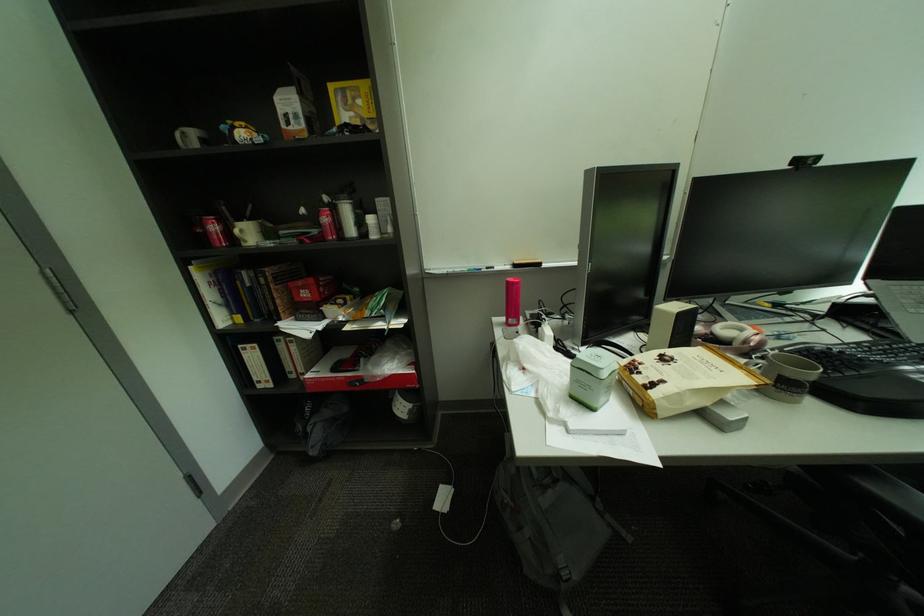
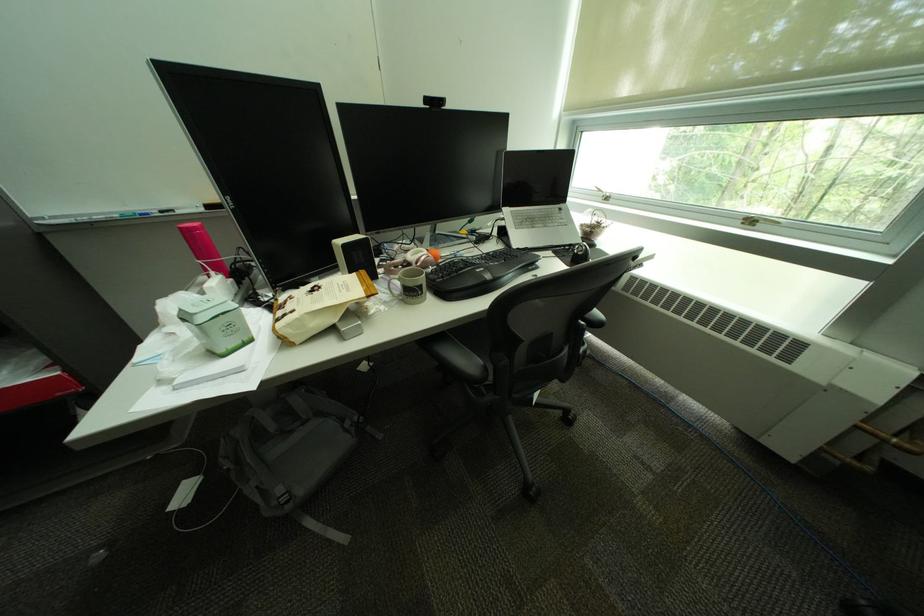
Where in the second image is the point corresponding to (x=710, y=341) from the first image?

(410, 268)